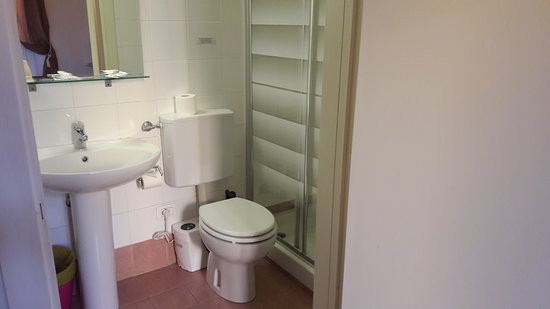
In order to click on bucket in this screenshot , I will do `click(62, 261)`.